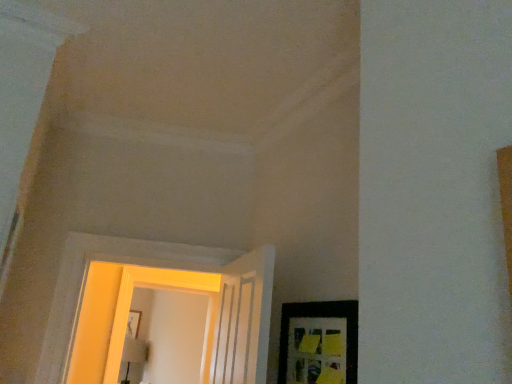
Question: Should I look upward or downward to see matte black picture frame at lower right?

Choices:
 (A) down
 (B) up

Answer: (A)

Question: Can you confirm if matte black picture frame at lower right is shorter than yellow painted wood door at center?

Choices:
 (A) no
 (B) yes

Answer: (B)

Question: Considering the relative sizes of matte black picture frame at lower right and yellow painted wood door at center in the image provided, is matte black picture frame at lower right wider than yellow painted wood door at center?

Choices:
 (A) no
 (B) yes

Answer: (A)

Question: Does matte black picture frame at lower right have a greater height compared to yellow painted wood door at center?

Choices:
 (A) yes
 (B) no

Answer: (B)

Question: Does matte black picture frame at lower right come in front of yellow painted wood door at center?

Choices:
 (A) no
 (B) yes

Answer: (B)

Question: Is matte black picture frame at lower right bigger than yellow painted wood door at center?

Choices:
 (A) yes
 (B) no

Answer: (B)

Question: Is matte black picture frame at lower right next to yellow painted wood door at center and touching it?

Choices:
 (A) no
 (B) yes

Answer: (A)

Question: Is yellow painted wood door at center not close to matte black picture frame at lower right?

Choices:
 (A) no
 (B) yes

Answer: (B)

Question: Can you confirm if yellow painted wood door at center is positioned to the right of matte black picture frame at lower right?

Choices:
 (A) yes
 (B) no

Answer: (B)

Question: Is yellow painted wood door at center facing away from matte black picture frame at lower right?

Choices:
 (A) no
 (B) yes

Answer: (A)

Question: From a real-world perspective, is yellow painted wood door at center physically above matte black picture frame at lower right?

Choices:
 (A) no
 (B) yes

Answer: (B)

Question: Is yellow painted wood door at center further to the viewer compared to matte black picture frame at lower right?

Choices:
 (A) yes
 (B) no

Answer: (A)

Question: Can you confirm if yellow painted wood door at center is bigger than matte black picture frame at lower right?

Choices:
 (A) no
 (B) yes

Answer: (B)

Question: Looking at the image, does yellow painted wood door at center seem bigger or smaller compared to matte black picture frame at lower right?

Choices:
 (A) big
 (B) small

Answer: (A)